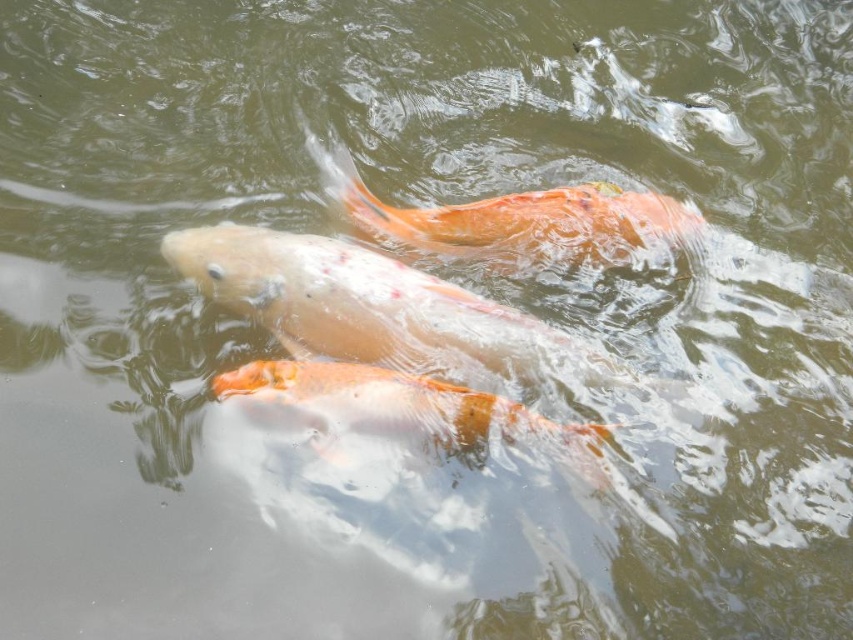
You are a fisherman trying to catch the speckled orange fish at center and the orange glossy fish at center. You have a net that can only catch fish wider than 20 cm. Based on the scene, can you determine if both fish can be caught with the net?

The speckled orange fish at center is wider than the orange glossy fish at center. However, without knowing the exact width of the speckled orange fish at center, it is impossible to determine if both fish are wider than 20 cm. The net requires fish wider than 20 cm, so only the speckled orange fish at center might qualify if its width exceeds 20 cm, but the orange glossy fish at center could be smaller. More information is needed.

In the scene shown: You are an aquatic photographer trying to capture both the orange glossy fish at center and the orange glossy goldfish at center in a single shot. Since your camera has a limited field of view, you need to know their relative positions. Which one is positioned to the left?

The orange glossy fish at center is positioned to the left of the orange glossy goldfish at center.